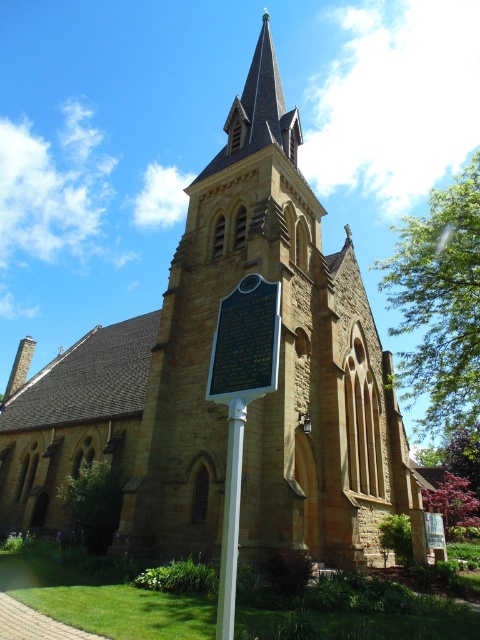
Does silver metallic plaque at center have a smaller size compared to white plastic pole at center?

Yes, silver metallic plaque at center is smaller than white plastic pole at center.

Which is behind, point (276, 323) or point (225, 557)?

The point (276, 323) is behind.

Is point (216, 333) more distant than point (227, 516)?

Yes, point (216, 333) is behind point (227, 516).

Where is `silver metallic plaque at center`? The image size is (480, 640). silver metallic plaque at center is located at coordinates point(245,342).